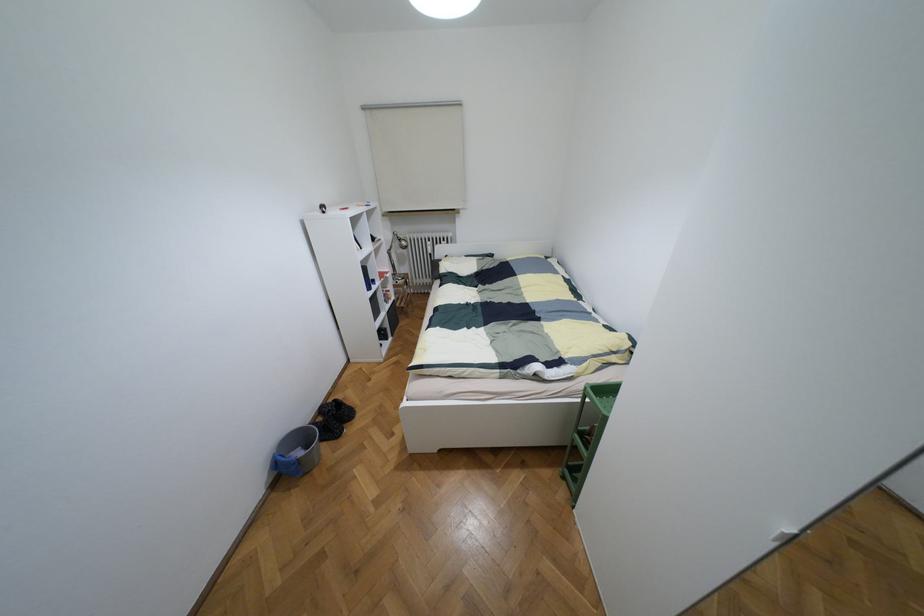
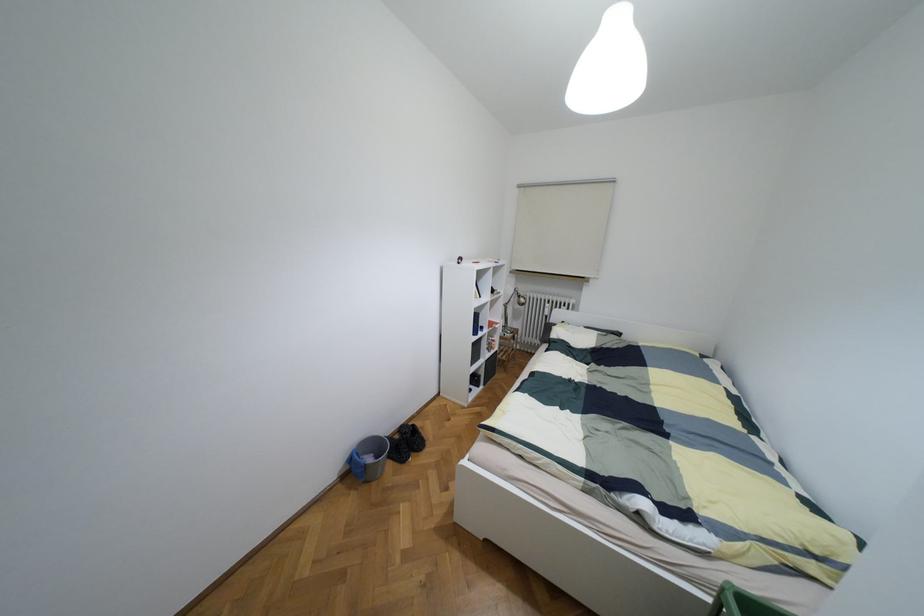
Locate, in the second image, the point that corresponds to (320,419) in the first image.

(395, 436)